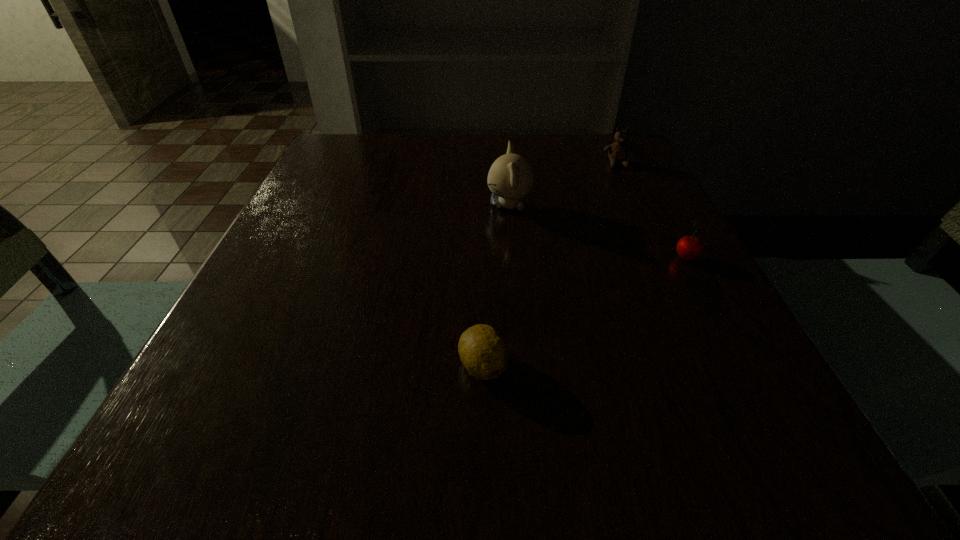
Identify the location of the second farthest object. (510, 177).

Identify the location of kitten. The image size is (960, 540). (510, 177).

Find the location of `the second nearest object`. the second nearest object is located at coordinates (689, 247).

Locate an element on the screen. teddy bear is located at coordinates (618, 151).

You are a GUI agent. You are given a task and a screenshot of the screen. Output one action in this format:
    pyautogui.click(x=<x>, y=<y>)
    Task: Click on the lemon
    
    Given the screenshot: What is the action you would take?
    pyautogui.click(x=482, y=350)

The height and width of the screenshot is (540, 960). I want to click on the nearest object, so click(x=482, y=350).

The height and width of the screenshot is (540, 960). Identify the location of vacant space located on the face of the tallest object. (392, 206).

Locate an element on the screen. The image size is (960, 540). free space located on the face of the tallest object is located at coordinates (401, 206).

This screenshot has height=540, width=960. In order to click on vacant space located 0.190m on the face of the tallest object in this screenshot , I will do `click(396, 206)`.

I want to click on free space located on the front of the cherry, so click(732, 343).